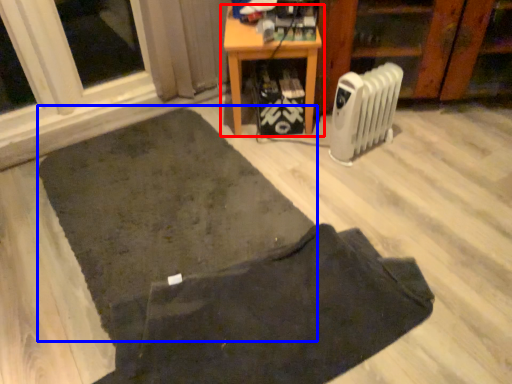
Question: Which object is further to the camera taking this photo, table (highlighted by a red box) or mat (highlighted by a blue box)?

Choices:
 (A) table
 (B) mat

Answer: (A)